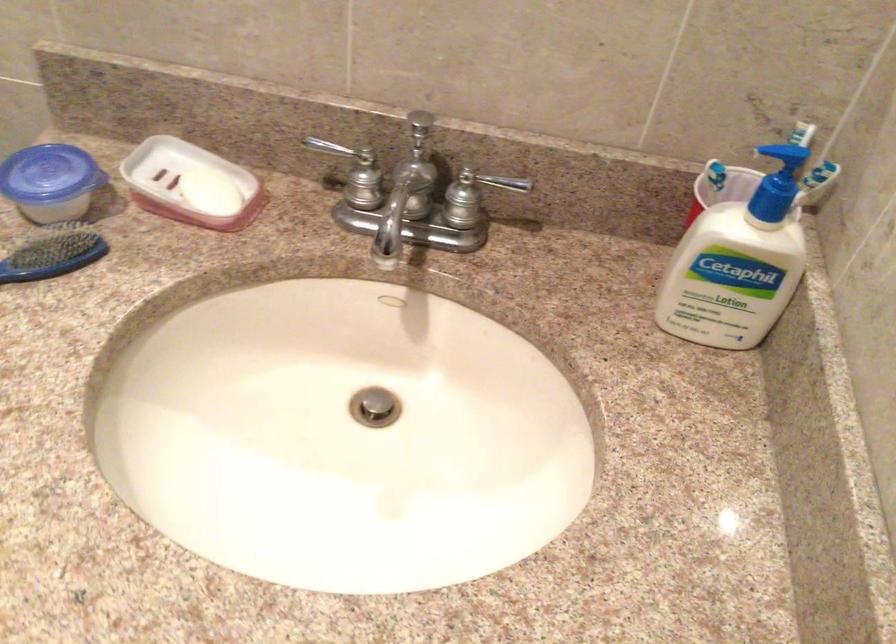
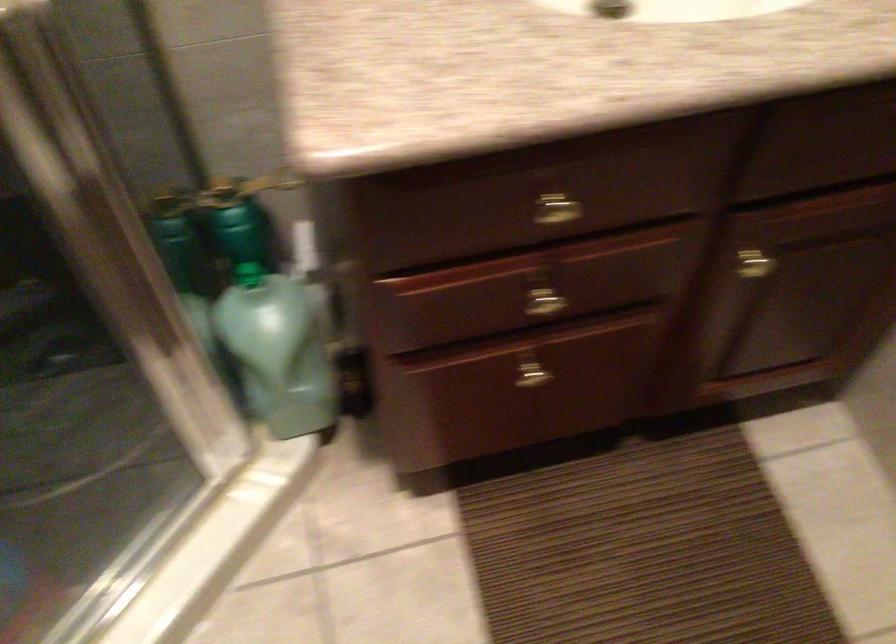
Question: In a continuous first-person perspective shot, in which direction is the camera moving?

Choices:
 (A) Left
 (B) Right
 (C) Forward
 (D) Backward

Answer: (A)